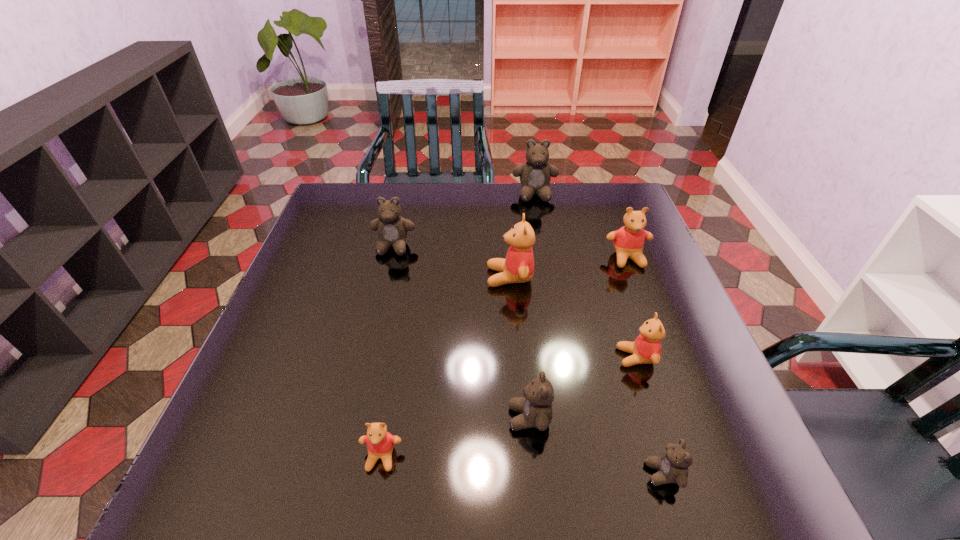
You are a GUI agent. You are given a task and a screenshot of the screen. Output one action in this format:
    pyautogui.click(x=<x>, y=<y>)
    Task: Click on the vacant space located on the front-facing side of the fourth nearest object
    The height and width of the screenshot is (540, 960).
    Given the screenshot: What is the action you would take?
    pyautogui.click(x=451, y=357)

Image resolution: width=960 pixels, height=540 pixels. I want to click on free region located on the front-facing side of the fourth nearest object, so click(x=530, y=357).

The image size is (960, 540). Identify the location of free region located 0.060m on the face of the second smallest brown teddy bear. (477, 418).

At what (x,y) coordinates should I click in order to perform the action: click on free space located on the face of the second smallest brown teddy bear. Please return your answer as a coordinate pair (x, y). This screenshot has height=540, width=960. Looking at the image, I should click on (430, 418).

Where is `vacant region located 0.190m on the face of the second smallest brown teddy bear`? vacant region located 0.190m on the face of the second smallest brown teddy bear is located at coordinates (409, 418).

At what (x,y) coordinates should I click in order to perform the action: click on vacant region located on the face of the nearest brown teddy bear. Please return your answer as a coordinate pair (x, y). Image resolution: width=960 pixels, height=540 pixels. Looking at the image, I should click on (606, 474).

At what (x,y) coordinates should I click in order to perform the action: click on free point located on the face of the nearest brown teddy bear. Please return your answer as a coordinate pair (x, y). Image resolution: width=960 pixels, height=540 pixels. Looking at the image, I should click on (508, 474).

Locate an element on the screen. This screenshot has width=960, height=540. free space located 0.200m on the face of the nearest brown teddy bear is located at coordinates (531, 474).

Locate an element on the screen. Image resolution: width=960 pixels, height=540 pixels. vacant space located on the front-facing side of the leftmost red teddy bear is located at coordinates (372, 510).

You are a GUI agent. You are given a task and a screenshot of the screen. Output one action in this format:
    pyautogui.click(x=<x>, y=<y>)
    Task: Click on the object that is at the far edge
    
    Given the screenshot: What is the action you would take?
    pyautogui.click(x=535, y=174)